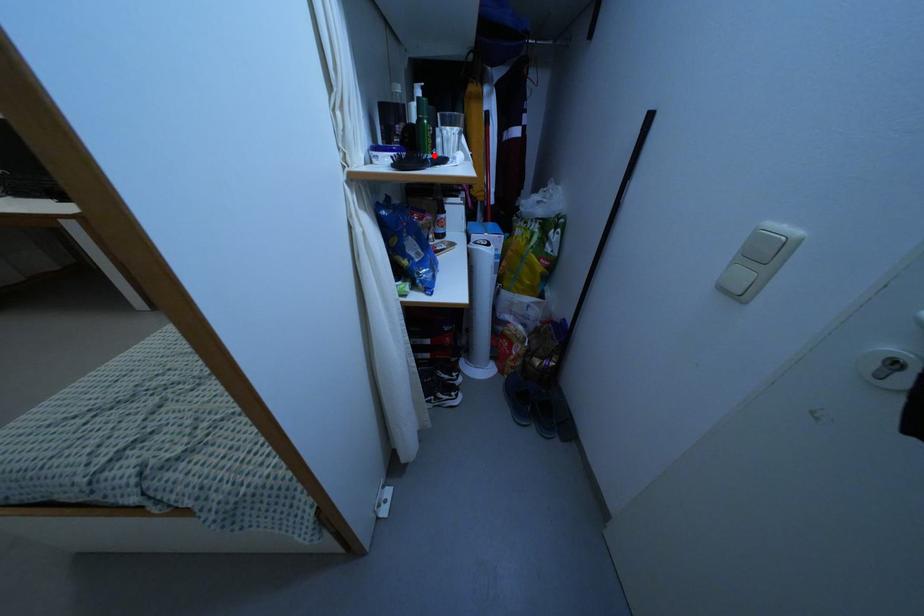
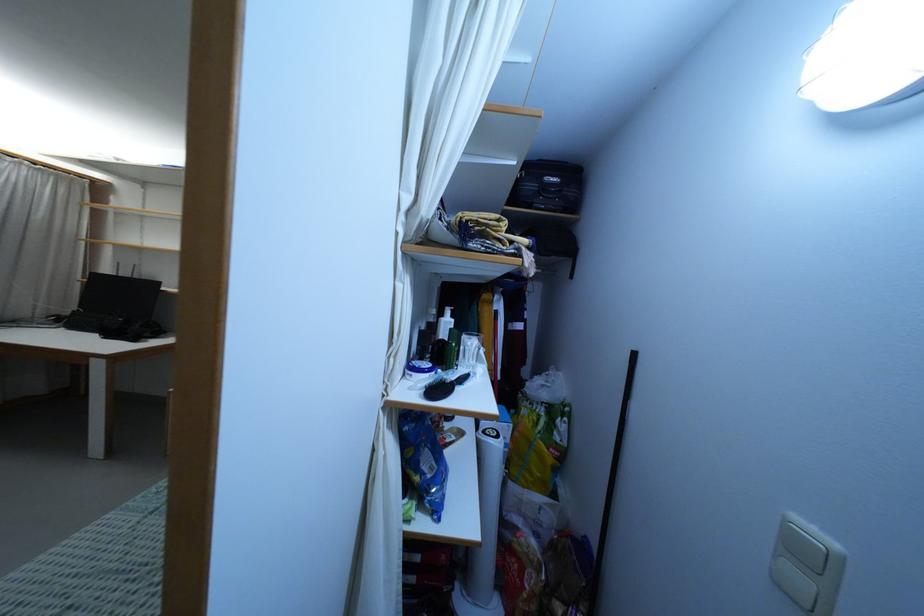
In the second image, find the point that corresponds to the highlighted location in the first image.

(456, 365)